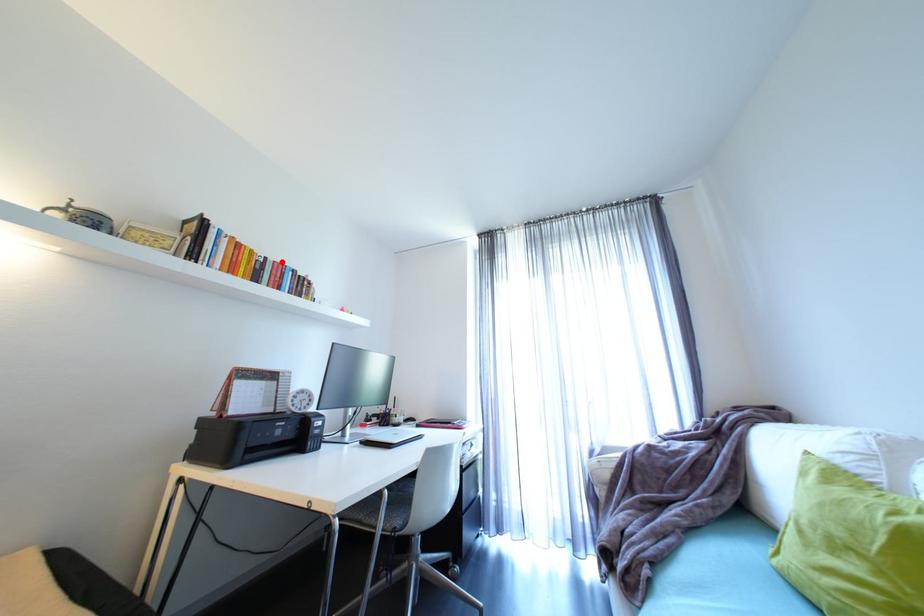
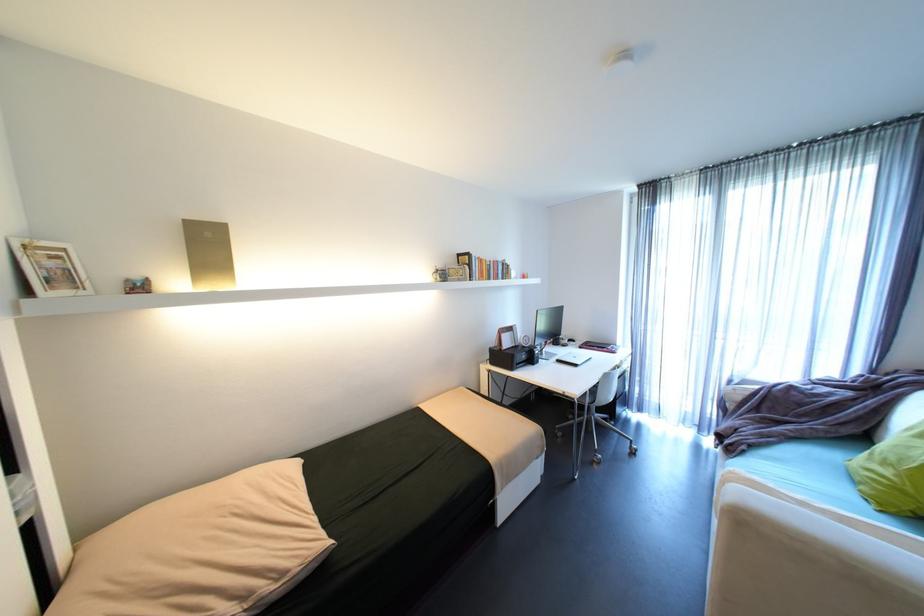
Locate, in the second image, the point that corresponds to the highlighted location in the first image.

(500, 262)